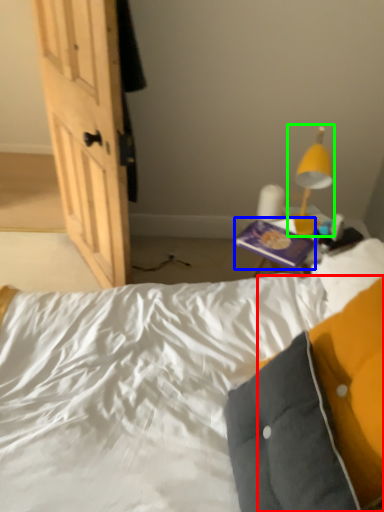
Question: Estimate the real-world distances between objects in this image. Which object is closer to pillow (highlighted by a red box), paperback book (highlighted by a blue box) or lamp (highlighted by a green box)?

Choices:
 (A) paperback book
 (B) lamp

Answer: (A)